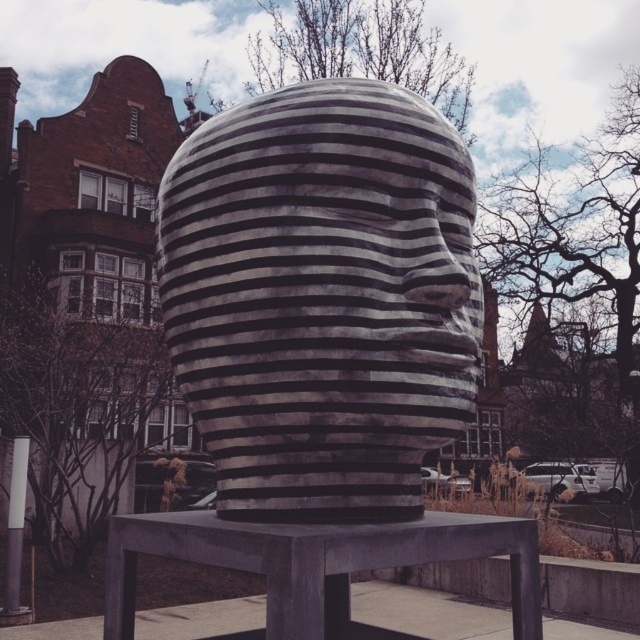
Question: Which object appears closest to the camera in this image?

Choices:
 (A) marble-like striped bust at center
 (B) smooth gray stool at center

Answer: (B)

Question: Which object appears farthest from the camera in this image?

Choices:
 (A) smooth gray stool at center
 (B) marble-like striped bust at center

Answer: (B)

Question: Does marble-like striped bust at center have a smaller size compared to smooth gray stool at center?

Choices:
 (A) yes
 (B) no

Answer: (B)

Question: Is marble-like striped bust at center below smooth gray stool at center?

Choices:
 (A) no
 (B) yes

Answer: (A)

Question: Can you confirm if marble-like striped bust at center is positioned to the left of smooth gray stool at center?

Choices:
 (A) no
 (B) yes

Answer: (A)

Question: Which of the following is the farthest from the observer?

Choices:
 (A) marble-like striped bust at center
 (B) smooth gray stool at center

Answer: (A)